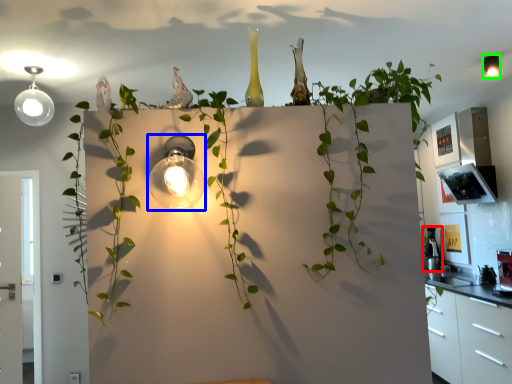
Question: Which object is positioned farthest from appliance (highlighted by a red box)? Select from light fixture (highlighted by a blue box) and light fixture (highlighted by a green box).

Choices:
 (A) light fixture
 (B) light fixture

Answer: (A)